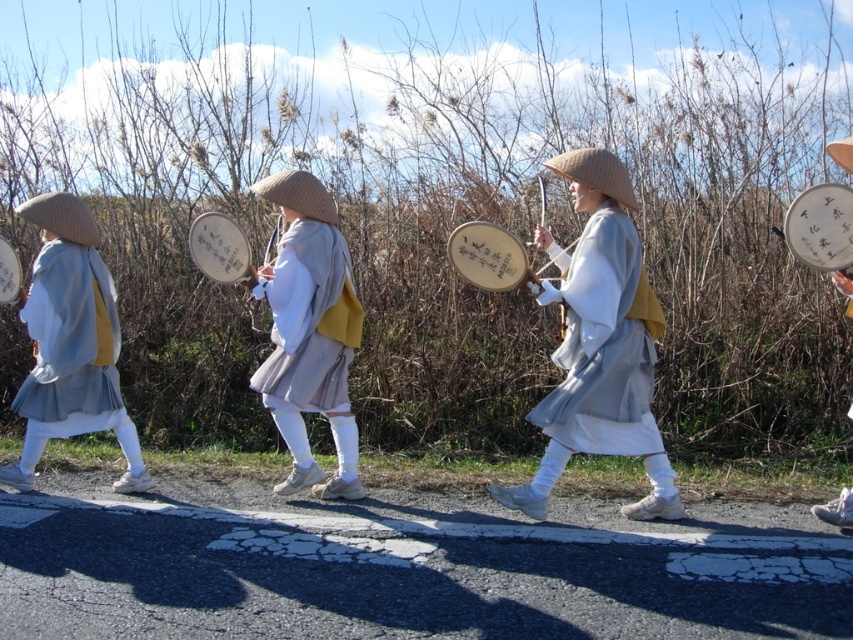
Who is higher up, matte gray robe at center or matte gray kimono at left?

Positioned higher is matte gray robe at center.

Measure the distance from matte gray robe at center to matte gray kimono at left.

3.03 meters

Is point (619, 444) positioned after point (97, 390)?

No.

Locate an element on the screen. matte gray robe at center is located at coordinates (599, 344).

At what (x,y) coordinates should I click in order to perform the action: click on white wooden drum at right. Please return your answer as a coordinate pair (x, y). Looking at the image, I should click on (821, 227).

Does white wooden drum at right have a greater width compared to matte white drum at right?

No.

Find the location of a particular element. The image size is (853, 640). white wooden drum at right is located at coordinates (821, 227).

Is matte gray robe at center below wooden drum at center?

Indeed, matte gray robe at center is positioned under wooden drum at center.

Which of these two, matte gray robe at center or wooden drum at center, stands shorter?

wooden drum at center

Does point (654, 445) lie in front of point (212, 237)?

Yes, point (654, 445) is closer to viewer.

I want to click on matte gray robe at center, so 599,344.